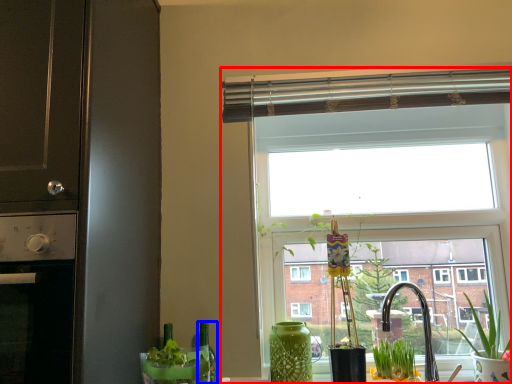
Question: Among these objects, which one is nearest to the camera, window (highlighted by a red box) or bottle (highlighted by a blue box)?

Choices:
 (A) window
 (B) bottle

Answer: (B)